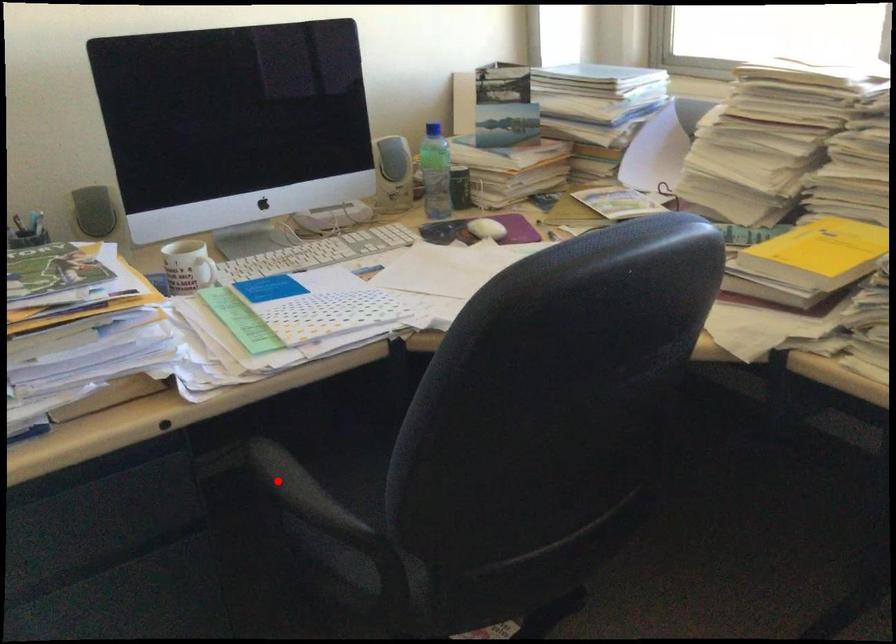
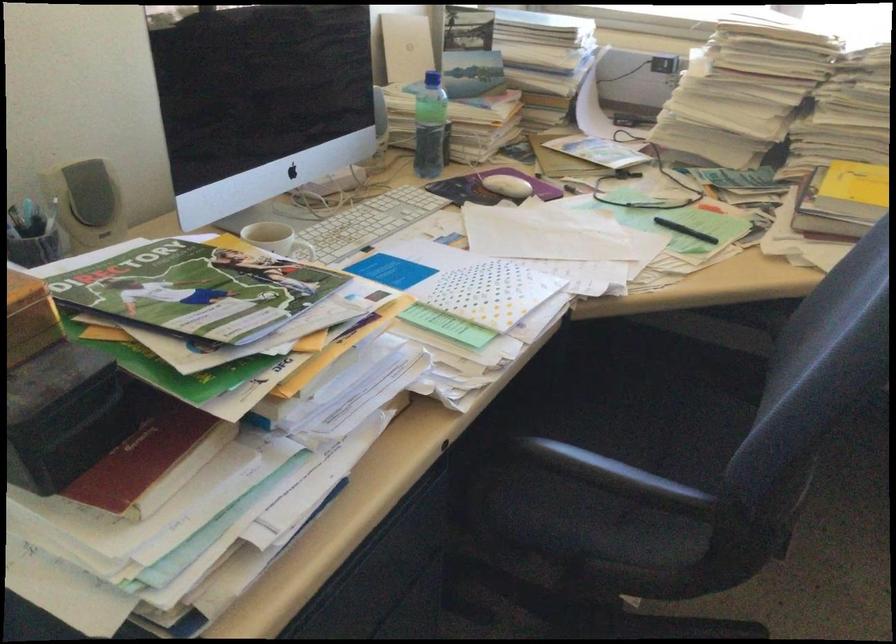
In the second image, find the point that corresponds to the highlighted location in the first image.

(614, 474)